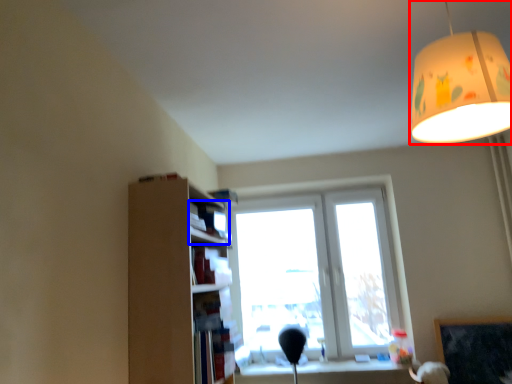
Question: Which of the following is the closest to the observer, lamp (highlighted by a red box) or book (highlighted by a blue box)?

Choices:
 (A) lamp
 (B) book

Answer: (A)